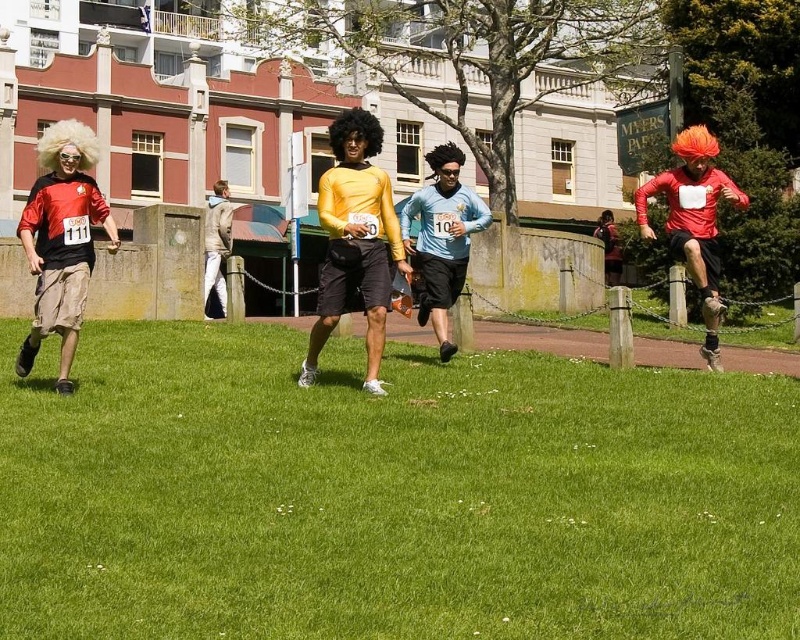
Question: Is green grass at center further to camera compared to light blue jersey at center?

Choices:
 (A) no
 (B) yes

Answer: (A)

Question: Is yellow matte shirt at center to the right of light blue jersey at center from the viewer's perspective?

Choices:
 (A) yes
 (B) no

Answer: (B)

Question: Which point is closer to the camera?

Choices:
 (A) (66, 257)
 (B) (758, 410)
 (C) (216, 228)
 (D) (604, 241)

Answer: (B)

Question: Does yellow matte shirt at center have a lesser width compared to light beige jacket at center?

Choices:
 (A) yes
 (B) no

Answer: (A)

Question: Which object is closer to the camera taking this photo?

Choices:
 (A) yellow matte shirt at center
 (B) matte black shorts at left
 (C) green grass at center
 (D) matte orange wig at right

Answer: (C)

Question: Which object is closer to the camera taking this photo?

Choices:
 (A) light blue jersey at center
 (B) light beige jacket at center

Answer: (A)